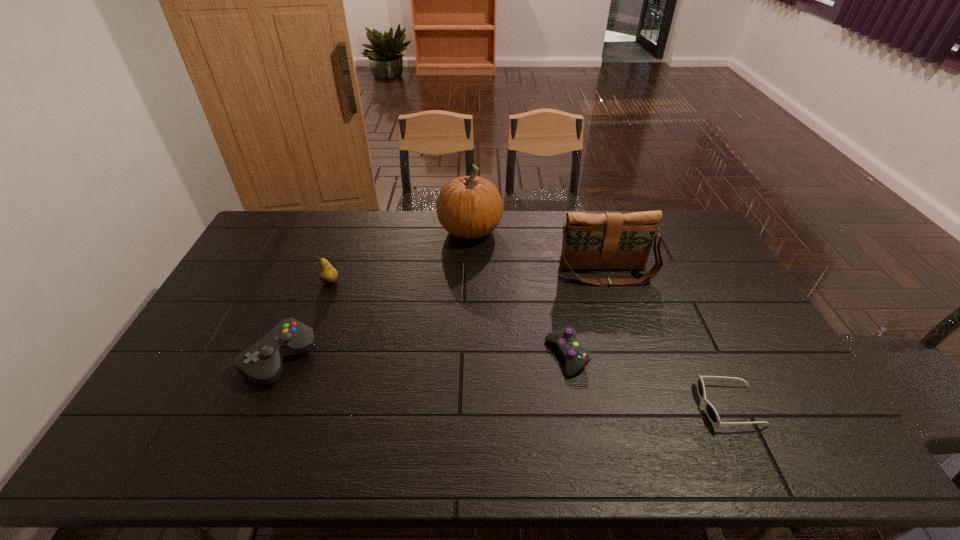
In order to click on pumpkin in this screenshot , I will do `click(469, 207)`.

You are a GUI agent. You are given a task and a screenshot of the screen. Output one action in this format:
    pyautogui.click(x=<x>, y=<y>)
    Task: Click on the fourth object from right to left
    The image size is (960, 540).
    Given the screenshot: What is the action you would take?
    pyautogui.click(x=469, y=207)

Locate an element on the screen. The width and height of the screenshot is (960, 540). shoulder bag is located at coordinates (610, 240).

You are a GUI agent. You are given a task and a screenshot of the screen. Output one action in this format:
    pyautogui.click(x=<x>, y=<y>)
    Task: Click on the pear
    Image resolution: width=960 pixels, height=540 pixels.
    Given the screenshot: What is the action you would take?
    pyautogui.click(x=328, y=275)

At what (x,y) coordinates should I click in order to perform the action: click on the left control. Please return your answer as a coordinate pair (x, y). Looking at the image, I should click on (262, 363).

This screenshot has width=960, height=540. Identify the location of the taller control. (262, 363).

Find the location of a particular element. This screenshot has width=960, height=540. the right control is located at coordinates [x=576, y=357].

In order to click on sunglasses in this screenshot , I will do `click(712, 414)`.

Find the location of a particular element. The width and height of the screenshot is (960, 540). vacant region located on the stem of the third object from left to right is located at coordinates (582, 230).

Find the location of a particular element. This screenshot has height=540, width=960. blank space located on the front-facing side of the fifth shortest object is located at coordinates (632, 352).